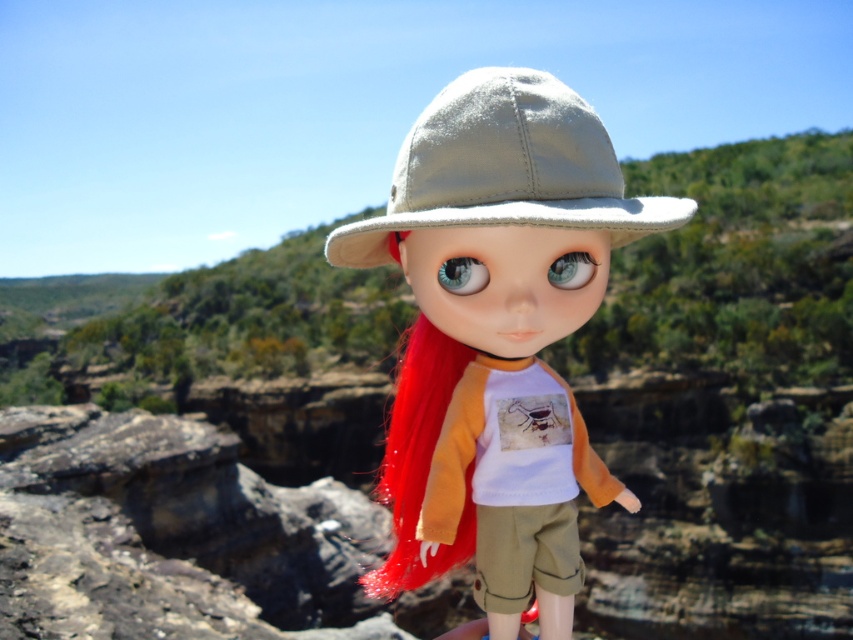
Does satin beige hat at center have a greater width compared to satin beige fedora at center?

No.

Which is above, satin beige hat at center or satin beige fedora at center?

Positioned higher is satin beige fedora at center.

Is point (544, 451) positioned behind point (403, 198)?

Yes, it is behind point (403, 198).

Where is `satin beige hat at center`? The width and height of the screenshot is (853, 640). satin beige hat at center is located at coordinates (498, 336).